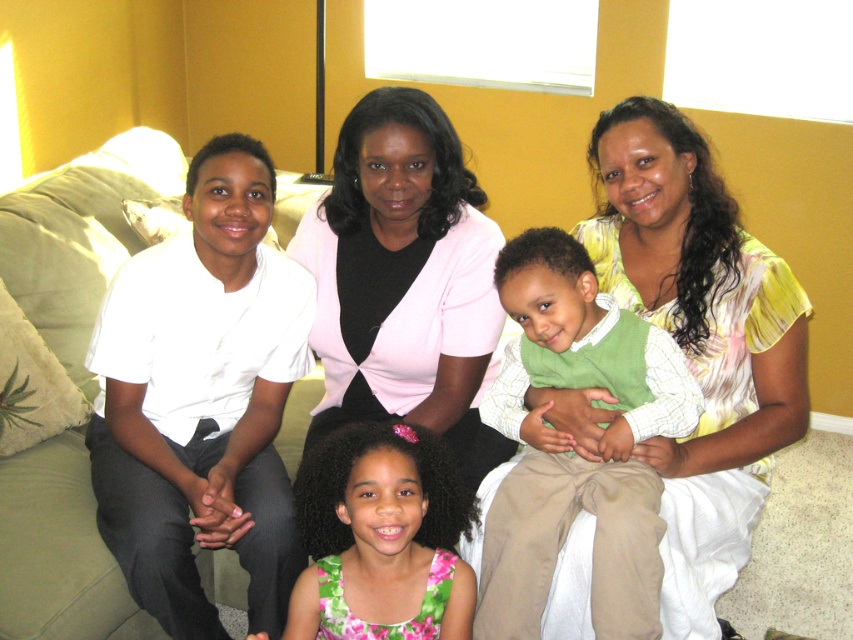
Question: Does white smooth shirt at left have a lesser width compared to matte white shirt at left?

Choices:
 (A) yes
 (B) no

Answer: (A)

Question: Among these objects, which one is farthest from the camera?

Choices:
 (A) matte white shirt at left
 (B) green cotton vest at center
 (C) white smooth shirt at left
 (D) green floral dress at center

Answer: (C)

Question: Estimate the real-world distances between objects in this image. Which object is closer to the matte white shirt at left?

Choices:
 (A) green floral dress at center
 (B) green cotton vest at center

Answer: (B)

Question: Which point appears closest to the camera in this image?

Choices:
 (A) (595, 353)
 (B) (607, 291)
 (C) (196, 300)

Answer: (A)

Question: Is white smooth shirt at left thinner than green floral dress at center?

Choices:
 (A) no
 (B) yes

Answer: (A)

Question: Where is pink satin blouse at center located in relation to green cotton vest at center in the image?

Choices:
 (A) left
 (B) right

Answer: (A)